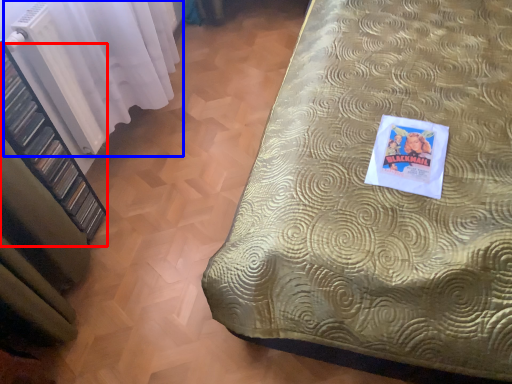
Question: Which object is closer to the camera taking this photo, shelf (highlighted by a red box) or curtain (highlighted by a blue box)?

Choices:
 (A) shelf
 (B) curtain

Answer: (A)